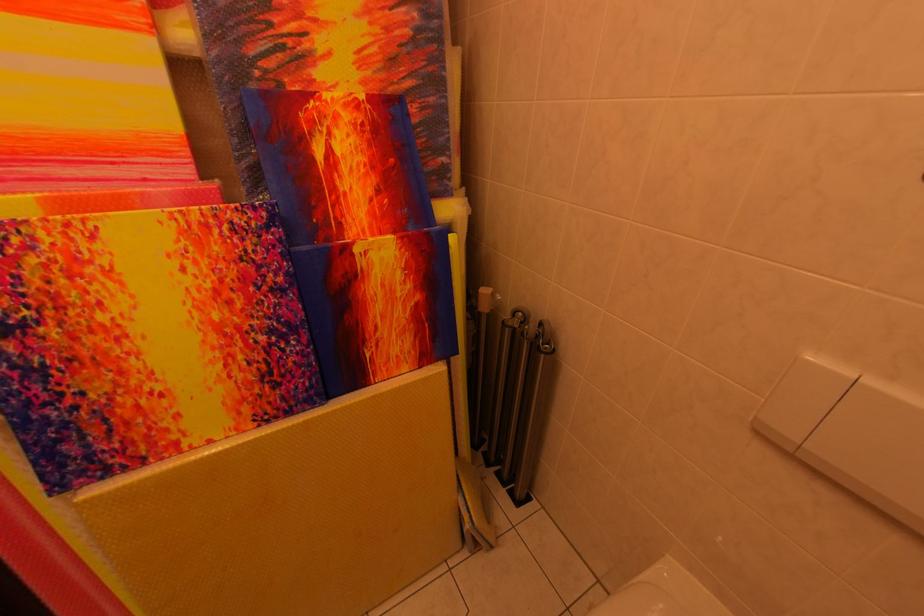
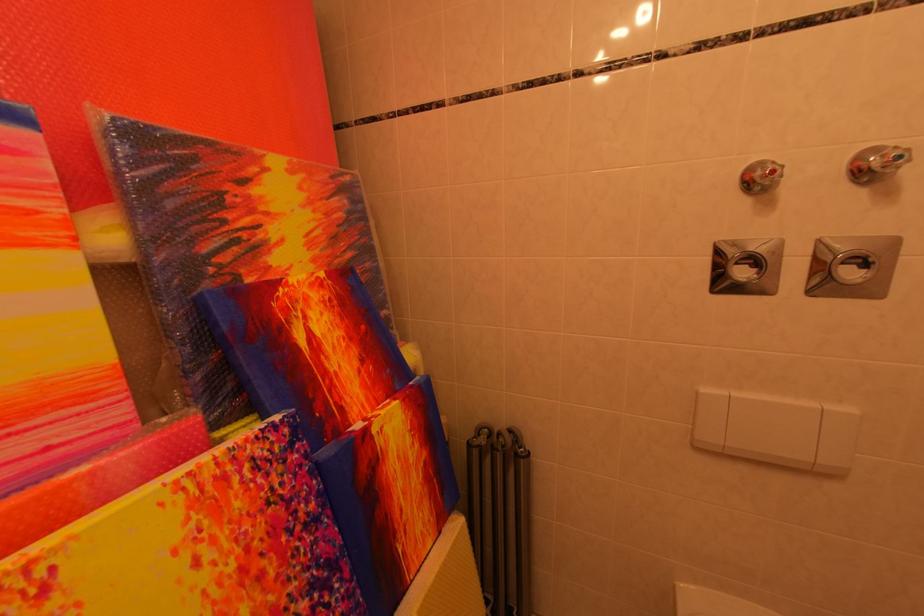
Find the pixel in the second image that matches pixel 288 245 in the first image.

(313, 460)